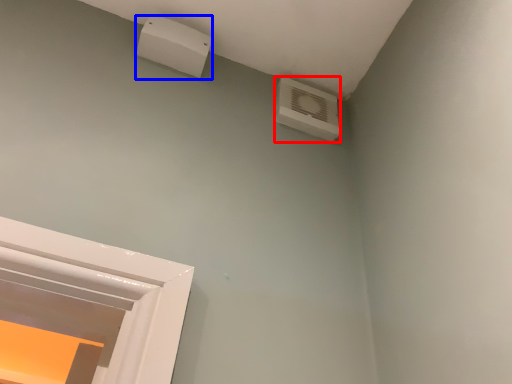
Question: Which point is closer to the camera, air conditioning (highlighted by a red box) or electric outlet (highlighted by a blue box)?

Choices:
 (A) air conditioning
 (B) electric outlet

Answer: (B)